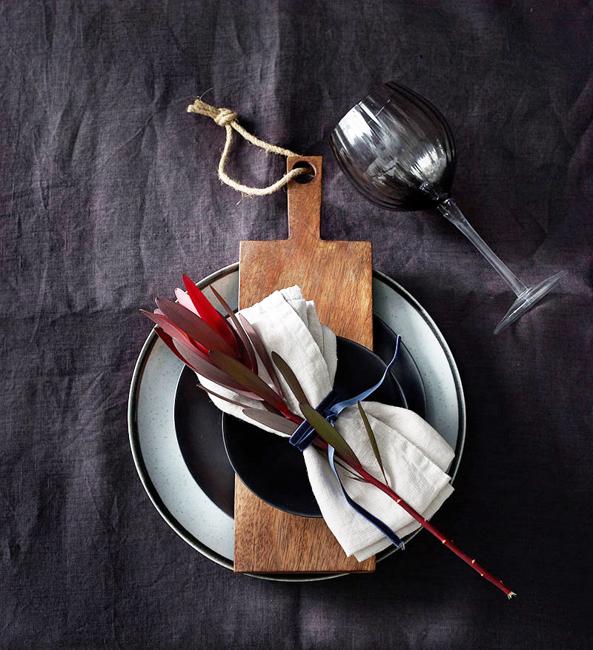
Identify the location of table cloth. This screenshot has width=593, height=650. (135, 147).